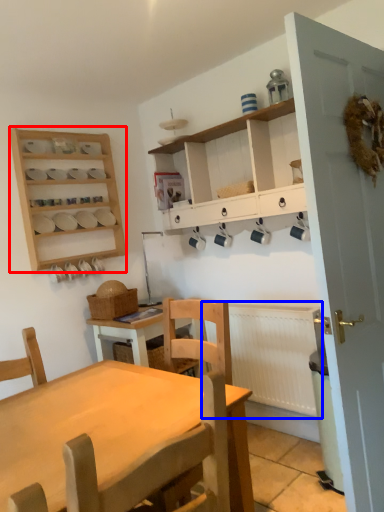
Question: Which object is closer to the camera taking this photo, shelf (highlighted by a red box) or radiator (highlighted by a blue box)?

Choices:
 (A) shelf
 (B) radiator

Answer: (B)